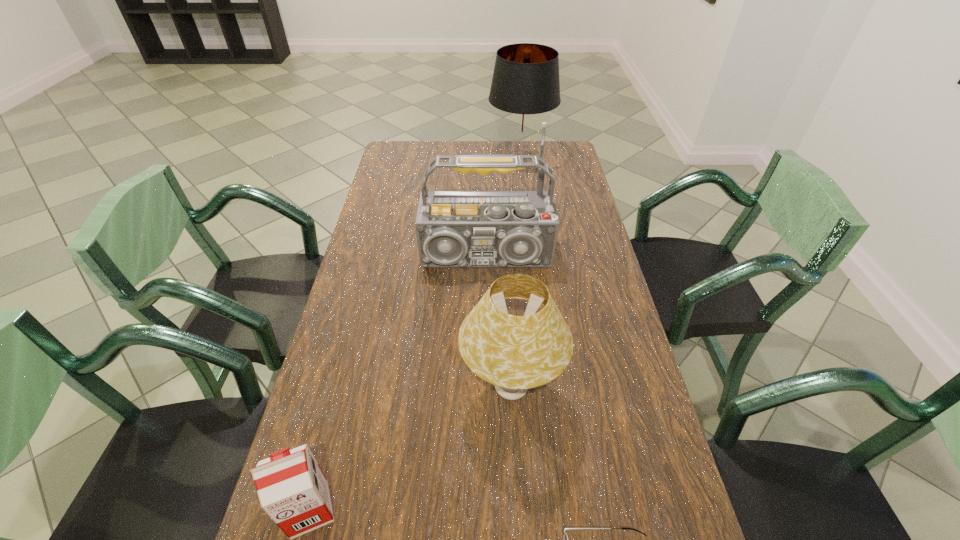
Locate an element on the screen. This screenshot has width=960, height=540. empty location between the leftmost object and the nearer lampshade is located at coordinates (411, 449).

Image resolution: width=960 pixels, height=540 pixels. I want to click on free area in between the leftmost object and the fourth nearest object, so click(x=398, y=385).

The height and width of the screenshot is (540, 960). I want to click on object that is the closest to the taller lampshade, so click(x=455, y=229).

Identify which object is located as the third nearest to the taller lampshade. Please provide its 2D coordinates. Your answer should be formatted as a tuple, i.e. [(x, y)], where the tuple contains the x and y coordinates of a point satisfying the conditions above.

[(292, 489)]

Identify the location of blank area in the image that satisfies the following two spatial constraints: 1. on the back side of the farthest object; 2. on the left side of the nearer lampshade. (497, 157).